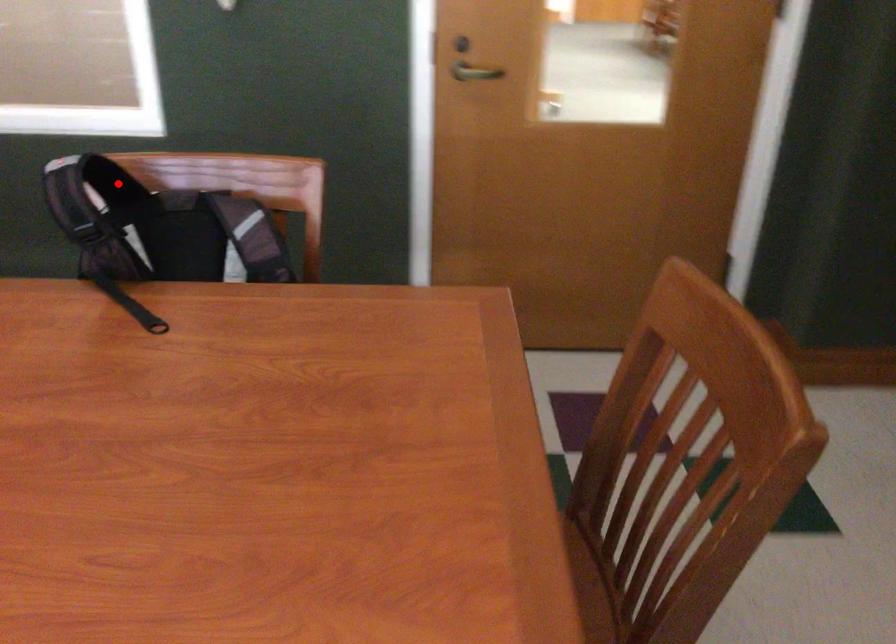
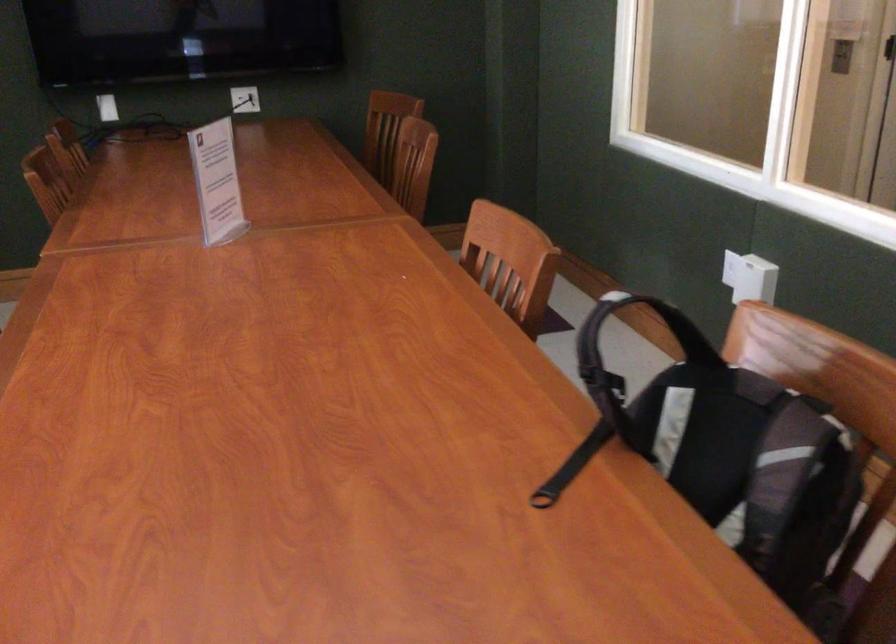
Question: I am providing you with two images of the same scene from different viewpoints. Image1 has a red point marked. In image2, the corresponding 3D location appears at what relative position? Reply with the corresponding letter.

Choices:
 (A) Closer
 (B) Farther

Answer: (A)